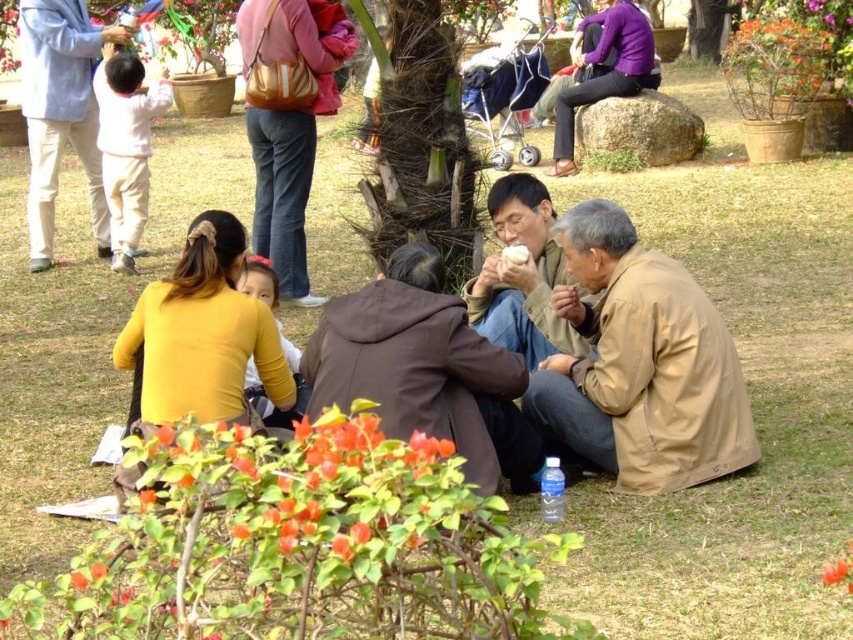
Question: Does brown leather jacket at center appear over orange matte flower at center?

Choices:
 (A) no
 (B) yes

Answer: (A)

Question: Which point is farther from the camera taking this photo?

Choices:
 (A) (517, 264)
 (B) (247, 259)

Answer: (A)

Question: Estimate the real-world distances between objects in this image. Which object is closer to the brown suede jacket at center?

Choices:
 (A) pink fabric purse at upper center
 (B) brown leather jacket at lower right
 (C) bright orange petals at lower center
 (D) purple matte sweater at upper right

Answer: (B)

Question: Does brown suede jacket at center appear over orange matte flower at lower center?

Choices:
 (A) no
 (B) yes

Answer: (B)

Question: Observing the image, what is the correct spatial positioning of brown leather jacket at center in reference to orange matte flower at center?

Choices:
 (A) above
 (B) below

Answer: (B)

Question: Which of these objects is positioned farthest from the white matte bread at center?

Choices:
 (A) orange matte flower at center
 (B) brown textured tree trunk at center
 (C) light blue denim jacket at upper left

Answer: (C)